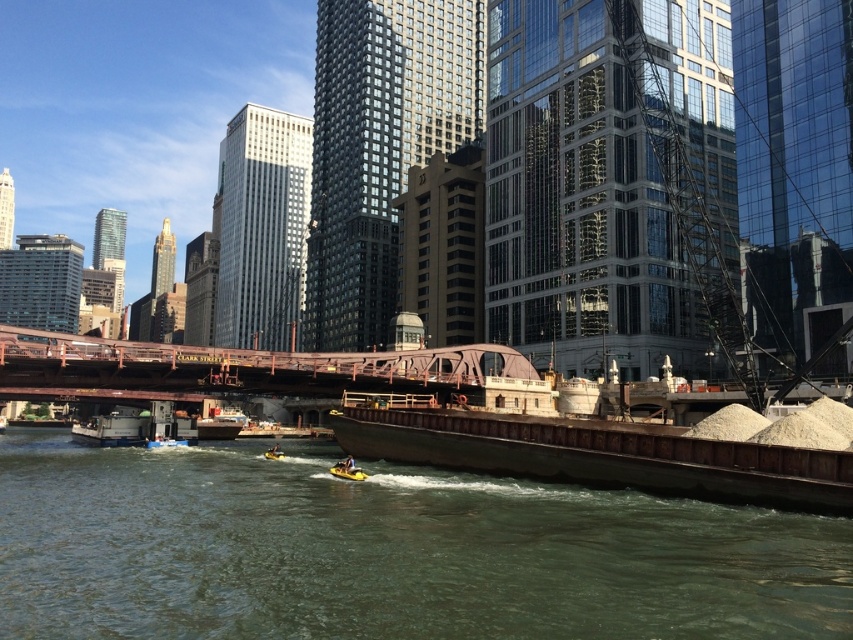
Is metallic gray barge at lower left bigger than yellow rubber boat at center?

Yes, metallic gray barge at lower left is bigger than yellow rubber boat at center.

I want to click on metallic gray barge at lower left, so click(x=114, y=428).

Is point (111, 436) behind point (347, 476)?

Yes, it is behind point (347, 476).

The height and width of the screenshot is (640, 853). I want to click on metallic gray barge at lower left, so click(x=114, y=428).

Which is in front, point (809, 472) or point (355, 480)?

Point (809, 472)

Does brown metallic barge at lower center come behind yellow rubber boat at center?

No, brown metallic barge at lower center is in front of yellow rubber boat at center.

What are the coordinates of `brown metallic barge at lower center` in the screenshot? It's located at (596, 454).

Which is above, brown metallic barge at lower center or rustic metal bridge at center?

rustic metal bridge at center is above.

Between brown metallic barge at lower center and rustic metal bridge at center, which one appears on the left side from the viewer's perspective?

rustic metal bridge at center

Describe the element at coordinates (596, 454) in the screenshot. The height and width of the screenshot is (640, 853). I see `brown metallic barge at lower center` at that location.

You are a GUI agent. You are given a task and a screenshot of the screen. Output one action in this format:
    pyautogui.click(x=<x>, y=<y>)
    Task: Click on the brown metallic barge at lower center
    
    Given the screenshot: What is the action you would take?
    pyautogui.click(x=596, y=454)